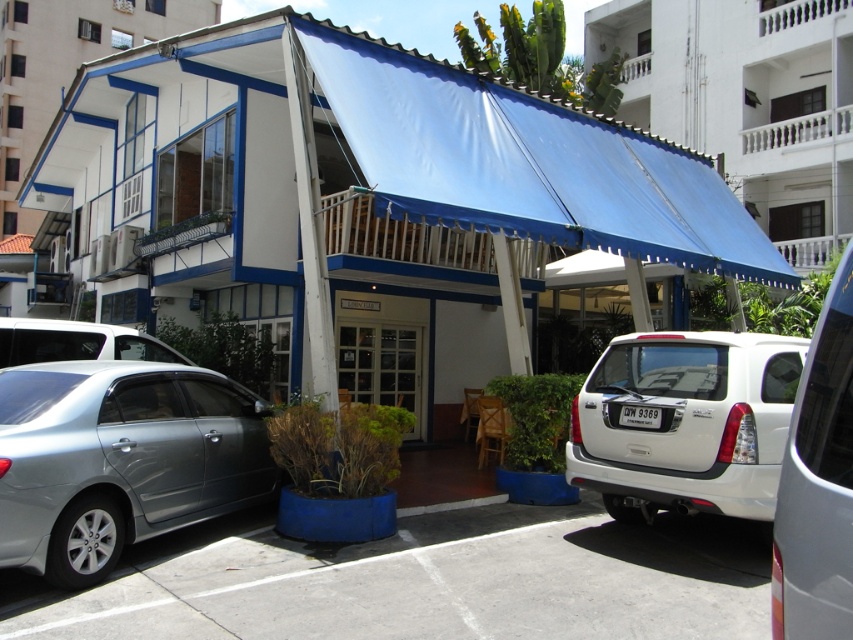
Is gray concrete parking lot at lower left positioned before blue fabric awning at upper center?

Yes, gray concrete parking lot at lower left is in front of blue fabric awning at upper center.

Does gray concrete parking lot at lower left appear on the left side of blue fabric awning at upper center?

Correct, you'll find gray concrete parking lot at lower left to the left of blue fabric awning at upper center.

Describe the element at coordinates (421, 582) in the screenshot. I see `gray concrete parking lot at lower left` at that location.

Locate an element on the screen. The image size is (853, 640). gray concrete parking lot at lower left is located at coordinates (421, 582).

Which of these two, satin silver sedan at left or silver metallic sedan at left, stands taller?

With more height is satin silver sedan at left.

Who is more forward, (222, 481) or (35, 362)?

Point (222, 481) is in front.

The height and width of the screenshot is (640, 853). What are the coordinates of `satin silver sedan at left` in the screenshot? It's located at (119, 460).

In the scene shown: Is blue fabric awning at upper center closer to the viewer compared to metallic silver car at right?

No, blue fabric awning at upper center is behind metallic silver car at right.

Does blue fabric awning at upper center have a larger size compared to metallic silver car at right?

Yes, blue fabric awning at upper center is bigger than metallic silver car at right.

Which is in front, point (845, 70) or point (793, 529)?

Point (793, 529) is in front.

Image resolution: width=853 pixels, height=640 pixels. In order to click on blue fabric awning at upper center in this screenshot , I will do `click(747, 100)`.